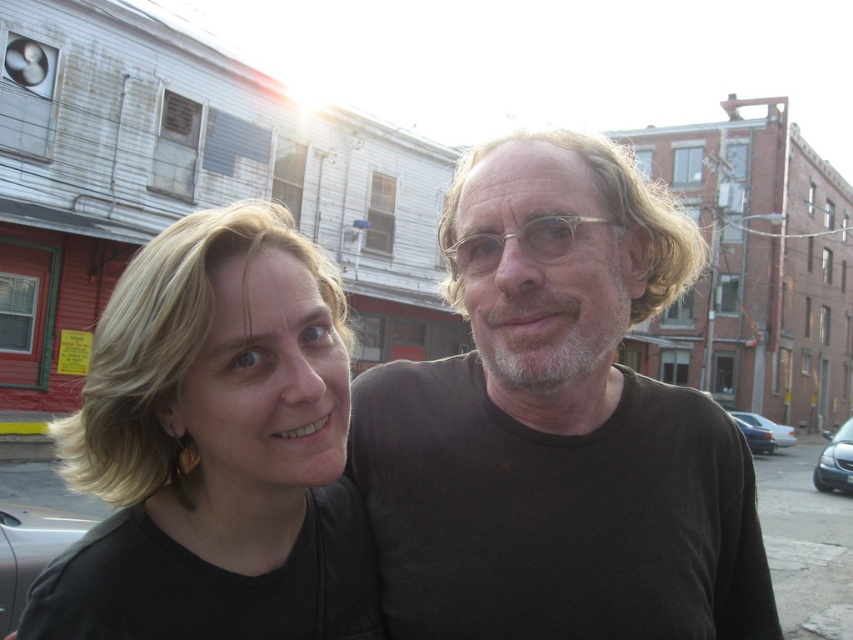
You are a photographer trying to capture a portrait of the two people in the scene. The matte black hair at left and the silver metallic car at lower left are both in the frame. Which object should you focus on to ensure the subject is in focus, considering their sizes?

The matte black hair at left is smaller than the silver metallic car at lower left, so focusing on the silver metallic car at lower left may result in the people being out of focus. To ensure the subjects are in focus, focus on the matte black hair at left since it is closer to the camera.

You are a photographer setting up a tripod in the middle of the scene. You need to position it so that it doesn not block the view of either the silver metallic car at lower left or the metallic silver sedan at lower right. Given their sizes, which car should you place the tripod closer to?

The silver metallic car at lower left occupies less space than the metallic silver sedan at lower right, so you should place the tripod closer to the silver metallic car at lower left to avoid blocking the view of the larger sedan.

You are a delivery person who needs to place a package on the silver metallic car at lower left. The package requires a 10 feet safety zone around it. If you place the package at the current position of matte black hair at left, will it be within the safety zone?

The distance between matte black hair at left and silver metallic car at lower left is 11.16 feet. Since the required safety zone is 10 feet, placing the package at the current position of matte black hair at left would exceed the safety zone by 1.16 feet. Therefore, it will not be within the safety zone.